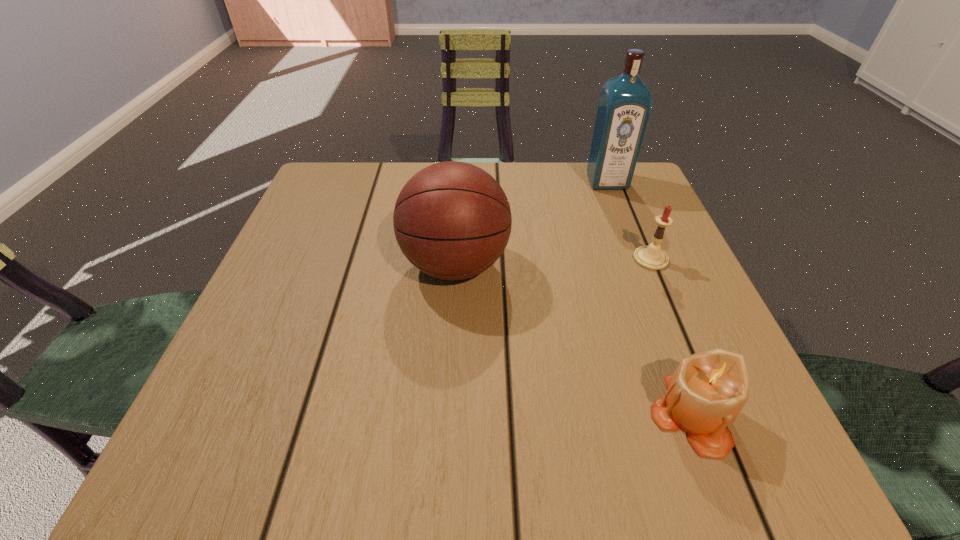
Locate an element on the screen. This screenshot has height=540, width=960. the tallest object is located at coordinates (625, 102).

Locate an element on the screen. The height and width of the screenshot is (540, 960). the farthest object is located at coordinates (625, 102).

The width and height of the screenshot is (960, 540). Find the location of `basketball`. basketball is located at coordinates (452, 220).

Where is `the third shortest object`? This screenshot has width=960, height=540. the third shortest object is located at coordinates (452, 220).

At what (x,y) coordinates should I click in order to perform the action: click on the farther candle. Please return your answer as a coordinate pair (x, y). The width and height of the screenshot is (960, 540). Looking at the image, I should click on (651, 257).

Find the location of a particular element. The image size is (960, 540). the nearest object is located at coordinates (708, 390).

Where is `free space located 0.230m on the flat label side of the farthest object`? free space located 0.230m on the flat label side of the farthest object is located at coordinates (636, 257).

This screenshot has height=540, width=960. I want to click on vacant space located 0.290m on the front of the basketball, so click(443, 474).

Identify the location of vacant area situated on the left of the farther candle. (571, 259).

The image size is (960, 540). I want to click on vacant area situated 0.120m on the left of the nearest object, so click(x=564, y=414).